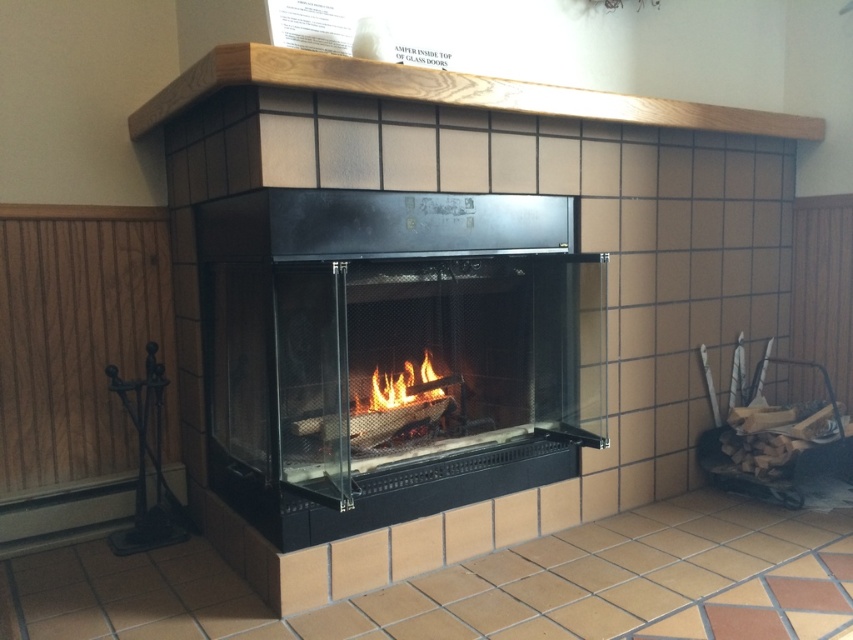
Question: Among these objects, which one is nearest to the camera?

Choices:
 (A) flamewoodfire at center
 (B) wooden mantle at upper center
 (C) black glass fireplace at center

Answer: (B)

Question: Is black glass fireplace at center to the right of wooden mantle at upper center from the viewer's perspective?

Choices:
 (A) no
 (B) yes

Answer: (A)

Question: Among these points, which one is nearest to the camera?

Choices:
 (A) (379, 396)
 (B) (415, 465)
 (C) (555, 115)

Answer: (B)

Question: Which of the following is the closest to the observer?

Choices:
 (A) black glass fireplace at center
 (B) wooden mantle at upper center
 (C) flamewoodfire at center

Answer: (B)

Question: Observing the image, what is the correct spatial positioning of wooden mantle at upper center in reference to flamewoodfire at center?

Choices:
 (A) right
 (B) left

Answer: (A)

Question: Can you confirm if wooden mantle at upper center is positioned below flamewoodfire at center?

Choices:
 (A) no
 (B) yes

Answer: (A)